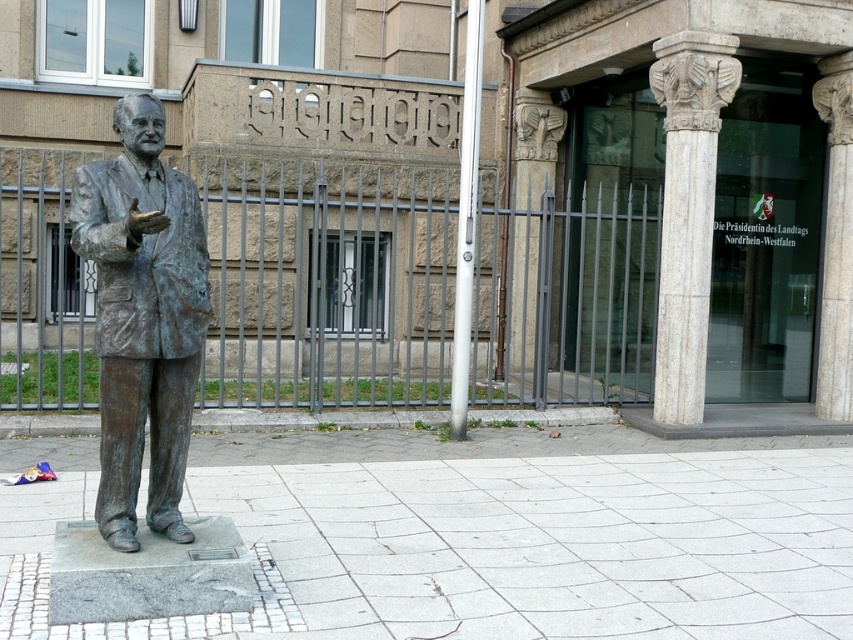
In the scene shown: Is bronze statue at center bigger than white marble column at center?

No.

Is point (103, 428) more distant than point (693, 29)?

No.

This screenshot has width=853, height=640. I want to click on bronze statue at center, so click(x=142, y=317).